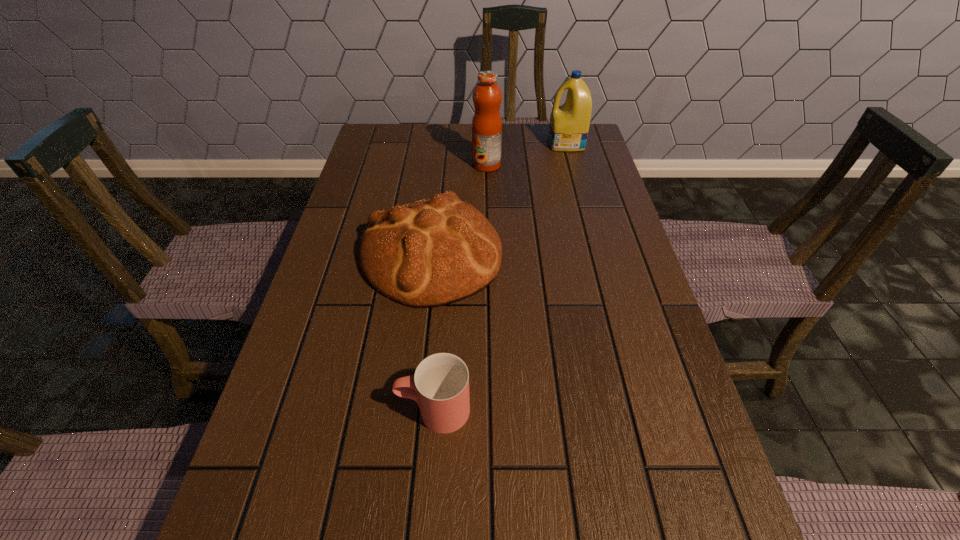
Where is `vacant position located on the label of the rightmost object`? This screenshot has height=540, width=960. vacant position located on the label of the rightmost object is located at coordinates (513, 144).

Locate an element on the screen. vacant space located on the label of the rightmost object is located at coordinates (506, 144).

The width and height of the screenshot is (960, 540). I want to click on vacant position located 0.220m on the right of the bread, so click(x=590, y=255).

Identify the location of vacant space located on the side of the nearest object with the handle. This screenshot has height=540, width=960. (316, 410).

You are a GUI agent. You are given a task and a screenshot of the screen. Output one action in this format:
    pyautogui.click(x=<x>, y=<y>)
    Task: Click on the free spot located 0.100m on the side of the nearest object with the handle
    The image size is (960, 540).
    Given the screenshot: What is the action you would take?
    pyautogui.click(x=344, y=410)

Locate an element on the screen. This screenshot has width=960, height=540. blank area located on the side of the nearest object with the handle is located at coordinates (283, 410).

The height and width of the screenshot is (540, 960). I want to click on fruit juice positioned at the far edge, so click(x=487, y=96).

Locate an element on the screen. detergent that is at the far edge is located at coordinates (569, 124).

Locate an element on the screen. The height and width of the screenshot is (540, 960). object that is at the left edge is located at coordinates (433, 252).

Find the location of `object that is at the right edge`. object that is at the right edge is located at coordinates (569, 124).